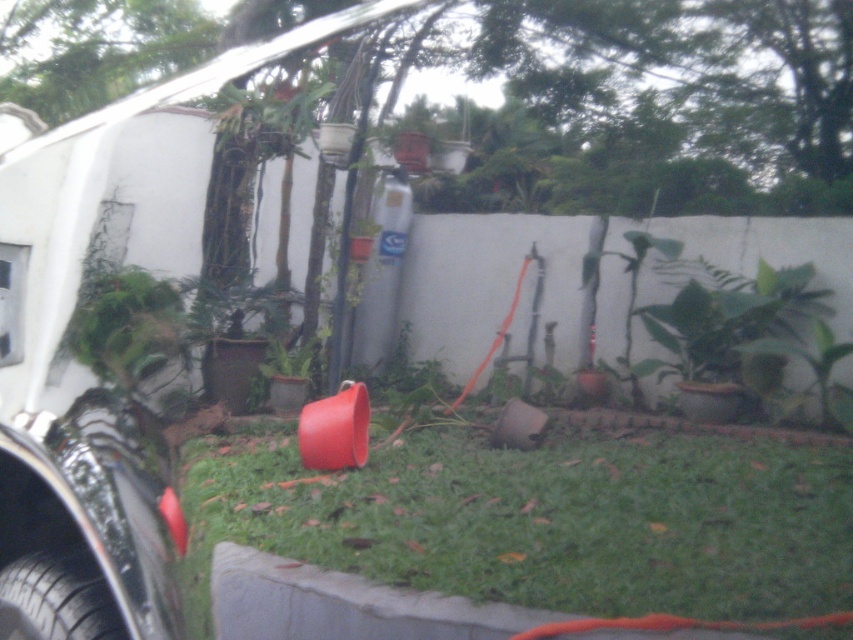
Question: Is gray concrete curb at lower left positioned in front of black rubber tire at lower left?

Choices:
 (A) yes
 (B) no

Answer: (B)

Question: Which object appears farthest from the camera in this image?

Choices:
 (A) green grass at center
 (B) black rubber tire at lower left

Answer: (A)

Question: Based on their relative distances, which object is farther from the gray concrete curb at lower left?

Choices:
 (A) black rubber tire at lower left
 (B) green grass at center

Answer: (B)

Question: Is gray concrete curb at lower left positioned in front of black rubber tire at lower left?

Choices:
 (A) yes
 (B) no

Answer: (B)

Question: Which of these objects is positioned farthest from the green grass at center?

Choices:
 (A) black rubber tire at lower left
 (B) gray concrete curb at lower left

Answer: (A)

Question: Does green grass at center come behind black rubber tire at lower left?

Choices:
 (A) yes
 (B) no

Answer: (A)